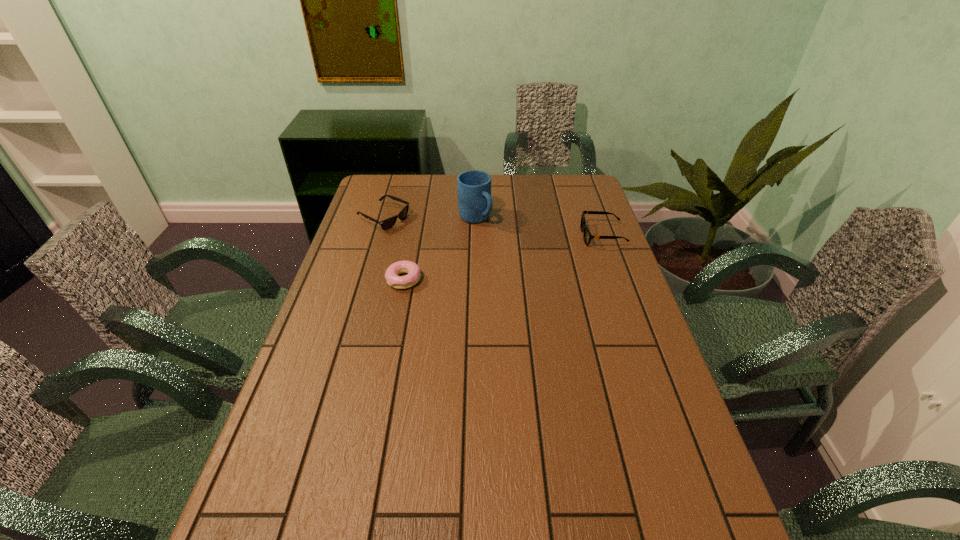
In the image, there is a desktop. What are the coordinates of `free space at the left edge` in the screenshot? It's located at (300, 451).

You are a GUI agent. You are given a task and a screenshot of the screen. Output one action in this format:
    pyautogui.click(x=<x>, y=<y>)
    Task: Click on the vacant space at the right edge of the desktop
    
    Given the screenshot: What is the action you would take?
    pyautogui.click(x=595, y=206)

Identify the location of free region at the far left corner. This screenshot has width=960, height=540. (403, 196).

The width and height of the screenshot is (960, 540). Identify the location of free space between the shortest object and the rightmost object. (503, 258).

The width and height of the screenshot is (960, 540). I want to click on free spot between the doughnut and the second object from right to left, so click(440, 249).

The height and width of the screenshot is (540, 960). I want to click on free point between the right sunglasses and the mug, so click(x=539, y=227).

Where is `vacant area that lies between the doughnut and the left sunglasses`? The width and height of the screenshot is (960, 540). vacant area that lies between the doughnut and the left sunglasses is located at coordinates (394, 249).

You are a GUI agent. You are given a task and a screenshot of the screen. Output one action in this format:
    pyautogui.click(x=<x>, y=<y>)
    Task: Click on the free space between the tallest object and the rightmost object
    
    Given the screenshot: What is the action you would take?
    pyautogui.click(x=539, y=227)

At what (x,y) coordinates should I click in order to perform the action: click on unoccupied position between the rightmost object and the shortest object. Please return your answer as a coordinate pair (x, y). The width and height of the screenshot is (960, 540). Looking at the image, I should click on (503, 258).

Locate an element on the screen. The height and width of the screenshot is (540, 960). vacant area between the mug and the doughnut is located at coordinates (440, 249).